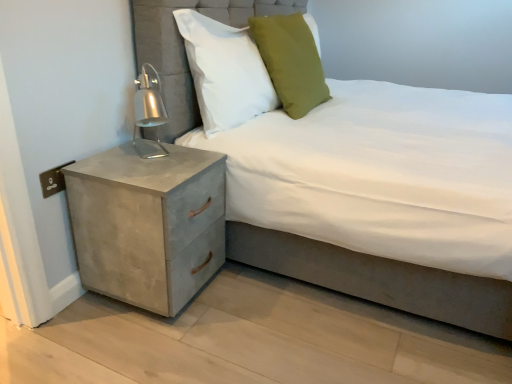
Question: Does suede-like gray bed at center have a smaller size compared to concrete textured nightstand at lower left?

Choices:
 (A) no
 (B) yes

Answer: (A)

Question: From a real-world perspective, is suede-like gray bed at center on top of concrete textured nightstand at lower left?

Choices:
 (A) yes
 (B) no

Answer: (A)

Question: From the image's perspective, is suede-like gray bed at center located beneath concrete textured nightstand at lower left?

Choices:
 (A) yes
 (B) no

Answer: (B)

Question: Can you confirm if suede-like gray bed at center is wider than concrete textured nightstand at lower left?

Choices:
 (A) yes
 (B) no

Answer: (A)

Question: Is suede-like gray bed at center positioned far away from concrete textured nightstand at lower left?

Choices:
 (A) no
 (B) yes

Answer: (A)

Question: Based on their sizes in the image, would you say suede-like gray bed at center is bigger or smaller than concrete textured nightstand at lower left?

Choices:
 (A) big
 (B) small

Answer: (A)

Question: Is suede-like gray bed at center to the left or to the right of concrete textured nightstand at lower left in the image?

Choices:
 (A) right
 (B) left

Answer: (A)

Question: Looking at their shapes, would you say suede-like gray bed at center is wider or thinner than concrete textured nightstand at lower left?

Choices:
 (A) wide
 (B) thin

Answer: (A)

Question: In terms of height, does suede-like gray bed at center look taller or shorter compared to concrete textured nightstand at lower left?

Choices:
 (A) short
 (B) tall

Answer: (B)

Question: From the image's perspective, is concrete textured nightstand at lower left positioned above or below suede-like gray bed at center?

Choices:
 (A) above
 (B) below

Answer: (B)

Question: Is concrete textured nightstand at lower left situated inside suede-like gray bed at center or outside?

Choices:
 (A) inside
 (B) outside

Answer: (A)

Question: From a real-world perspective, is concrete textured nightstand at lower left above or below suede-like gray bed at center?

Choices:
 (A) above
 (B) below

Answer: (B)

Question: In terms of width, does concrete textured nightstand at lower left look wider or thinner when compared to suede-like gray bed at center?

Choices:
 (A) wide
 (B) thin

Answer: (B)

Question: In terms of size, does concrete textured nightstand at lower left appear bigger or smaller than white fabric pillow at upper center, the 1th pillow when ordered from left to right?

Choices:
 (A) big
 (B) small

Answer: (A)

Question: From a real-world perspective, is concrete textured nightstand at lower left physically located above or below white fabric pillow at upper center, which ranks as the second pillow in right-to-left order?

Choices:
 (A) above
 (B) below

Answer: (B)